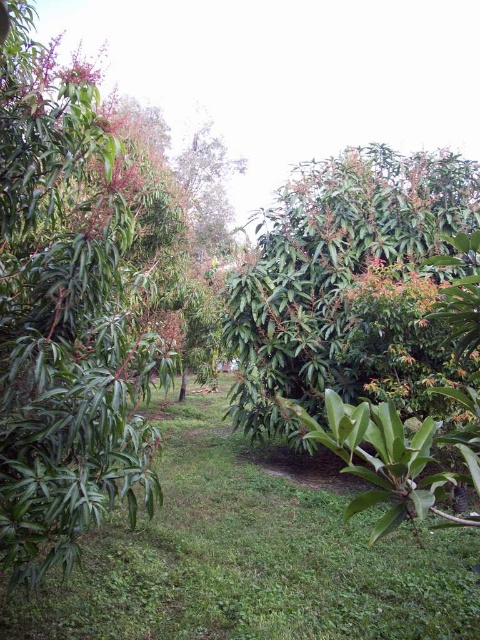
Question: Which point is closer to the camera?

Choices:
 (A) green glossy tree at center
 (B) green grass at center
 (C) green glossy leafy tree at left

Answer: (C)

Question: Which point is farther to the camera?

Choices:
 (A) (322, 340)
 (B) (144, 285)

Answer: (A)

Question: Is green glossy leafy tree at left wider than green glossy tree at center?

Choices:
 (A) no
 (B) yes

Answer: (A)

Question: Is green glossy leafy tree at left closer to camera compared to green grass at center?

Choices:
 (A) yes
 (B) no

Answer: (A)

Question: Is green glossy leafy tree at left smaller than green grass at center?

Choices:
 (A) yes
 (B) no

Answer: (B)

Question: Estimate the real-world distances between objects in this image. Which object is closer to the green grass at center?

Choices:
 (A) green glossy tree at center
 (B) green glossy leafy tree at left

Answer: (B)